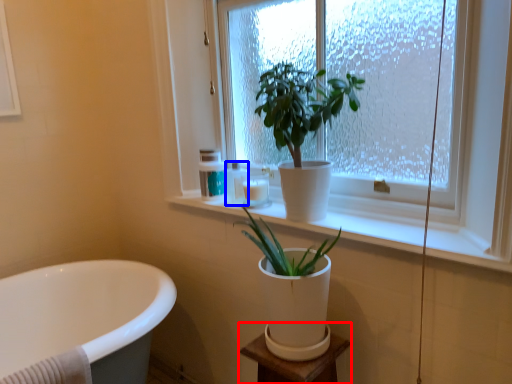
Question: Which of the following is the closest to the observer, vanity (highlighted by a red box) or toiletry (highlighted by a blue box)?

Choices:
 (A) vanity
 (B) toiletry

Answer: (A)